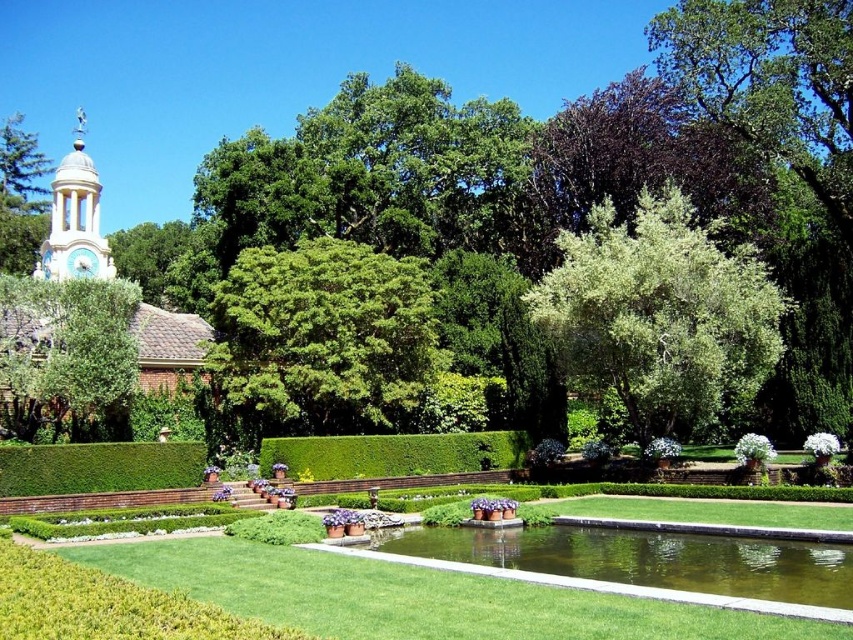
Does green leafy tree at center-right lie behind green grass at center?

Yes, it is behind green grass at center.

Is green leafy tree at center-right taller than green grass at center?

Yes, green leafy tree at center-right is taller than green grass at center.

Does point (682, 291) come farther from viewer compared to point (384, 563)?

Yes.

Find the location of a particular element. The image size is (853, 640). green leafy tree at center-right is located at coordinates click(660, 316).

Does green leafy tree at center-right come behind green leafy tree at upper left?

That is True.

Is green leafy tree at center-right shorter than green leafy tree at upper left?

No.

This screenshot has height=640, width=853. What are the coordinates of `green leafy tree at center-right` in the screenshot? It's located at (660, 316).

The image size is (853, 640). Identify the location of green leafy tree at center-right. (660, 316).

Can you confirm if green leafy tree at center-right is smaller than green concrete pond at center?

No.

In the scene shown: Is the position of green leafy tree at center-right less distant than that of green concrete pond at center?

That is False.

Which is behind, point (651, 417) or point (518, 531)?

Positioned behind is point (651, 417).

Find the location of a particular element. The width and height of the screenshot is (853, 640). green leafy tree at center-right is located at coordinates (660, 316).